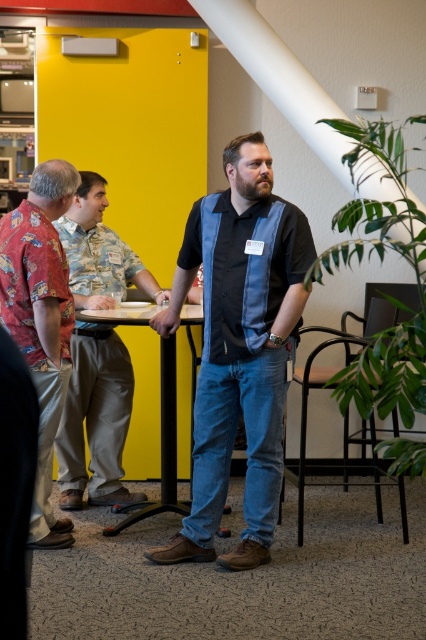
You are a person standing in the break room and want to know which item is taller between the matte khaki pants at left and the printed fabric shirt at left. Which one is taller?

The matte khaki pants at left is much taller than the printed fabric shirt at left.

Based on the scene description, where is the printed fabric shirt at left located in relation to the other objects?

The printed fabric shirt at left is located at point (40, 321).

In the break room scene, there is a matte khaki pants at left and a black plastic table at center. Which object is positioned to the left of the other?

The matte khaki pants at left are positioned to the left of the black plastic table at center.